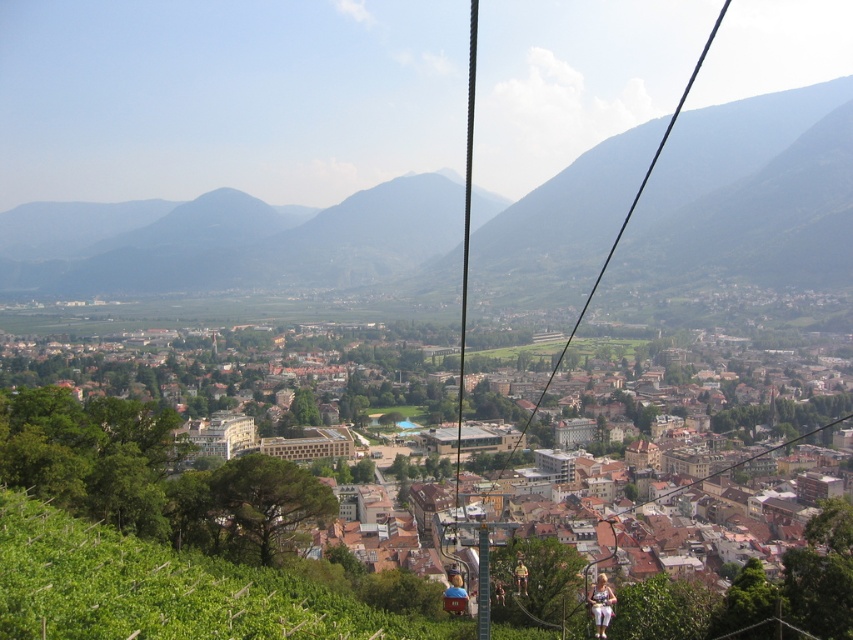
You are a tourist standing in the cable car and looking out the window. You see the brown wooden buildings at center and the yellow fabric jacket at lower right. Which object is higher in the scene?

The brown wooden buildings at center are higher than the yellow fabric jacket at lower right because they are positioned above it in the scene.

You are a photographer standing at the cable car window. You want to capture a photo that includes both the brown wooden buildings at center and the yellow fabric jacket at lower right. Which object should you focus on first to ensure both are in frame?

You should focus on the brown wooden buildings at center first since they are taller than the yellow fabric jacket at lower right, ensuring both are in frame by adjusting the camera angle to include the lower positioned jacket.

You are a passenger in the metallic cable car at center. You want to know your current position in the coordinate system where the bottom left corner is the origin. What are your coordinates?

The metallic cable car at center is located at coordinates approximately 0.303 on the x axis and 0.549 on the y axis.